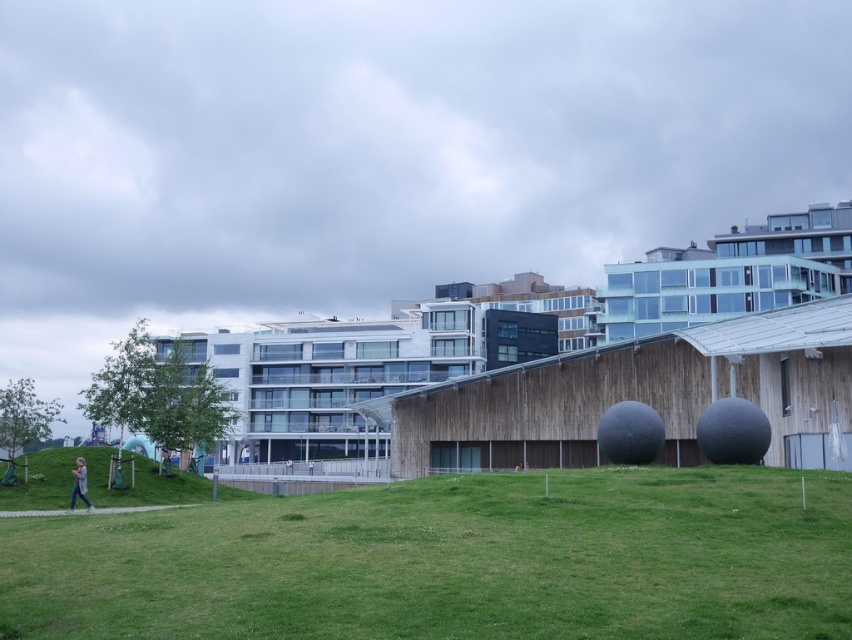
Can you confirm if green grass at center is smaller than green grassy hillside at lower left?

Yes.

Does green grass at center appear under green grassy hillside at lower left?

No, green grass at center is not below green grassy hillside at lower left.

Locate an element on the screen. green grass at center is located at coordinates pyautogui.click(x=453, y=561).

Is green grassy hillside at lower left taller than light blue jeans at lower left?

Indeed, green grassy hillside at lower left has a greater height compared to light blue jeans at lower left.

Is green grassy hillside at lower left further to camera compared to light blue jeans at lower left?

Yes, green grassy hillside at lower left is behind light blue jeans at lower left.

The width and height of the screenshot is (852, 640). Find the location of `green grassy hillside at lower left`. green grassy hillside at lower left is located at coordinates (98, 481).

Can you confirm if green grass at center is positioned to the left of light blue jeans at lower left?

No, green grass at center is not to the left of light blue jeans at lower left.

From the picture: Which is above, green grass at center or light blue jeans at lower left?

green grass at center

Which is behind, point (257, 540) or point (84, 476)?

The point (84, 476) is behind.

You are a GUI agent. You are given a task and a screenshot of the screen. Output one action in this format:
    pyautogui.click(x=<x>, y=<y>)
    Task: Click on the green grass at center
    This screenshot has height=640, width=852.
    Given the screenshot: What is the action you would take?
    pyautogui.click(x=453, y=561)